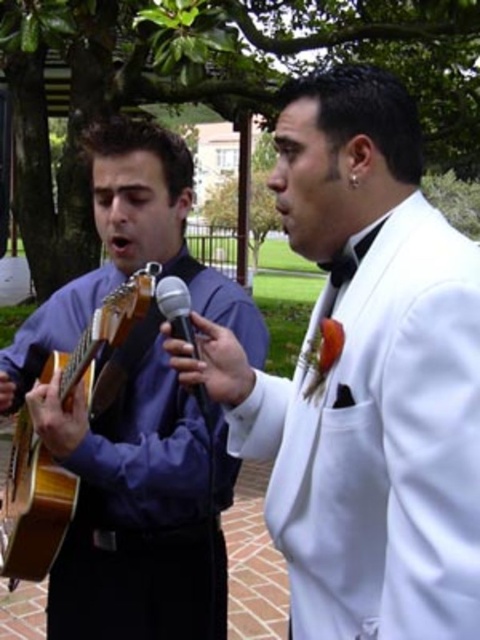
Question: Is the position of white satin suit at right more distant than that of black metallic microphone at center?

Choices:
 (A) no
 (B) yes

Answer: (A)

Question: Which point is closer to the camera taking this photo?

Choices:
 (A) (425, 445)
 (B) (35, 579)

Answer: (A)

Question: Which of the following is the farthest from the observer?

Choices:
 (A) (24, 440)
 (B) (407, 236)
 (C) (180, 307)
 (D) (62, 632)

Answer: (A)

Question: Is matte purple shirt at left to the left of black metallic microphone at center from the viewer's perspective?

Choices:
 (A) yes
 (B) no

Answer: (A)

Question: Which object appears closest to the camera in this image?

Choices:
 (A) wooden acoustic guitar at left
 (B) matte purple shirt at left

Answer: (A)

Question: Does wooden acoustic guitar at left appear on the right side of black metallic microphone at center?

Choices:
 (A) yes
 (B) no

Answer: (B)